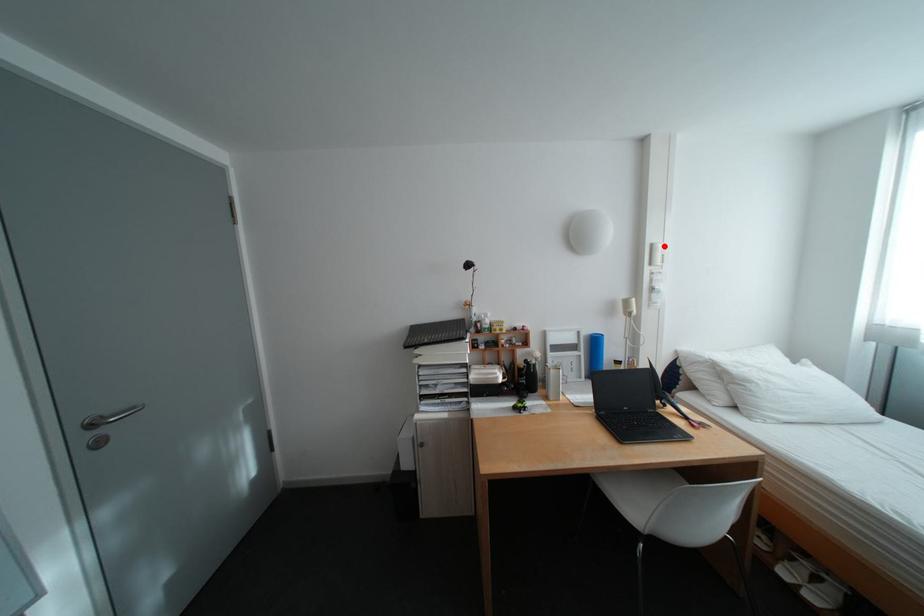
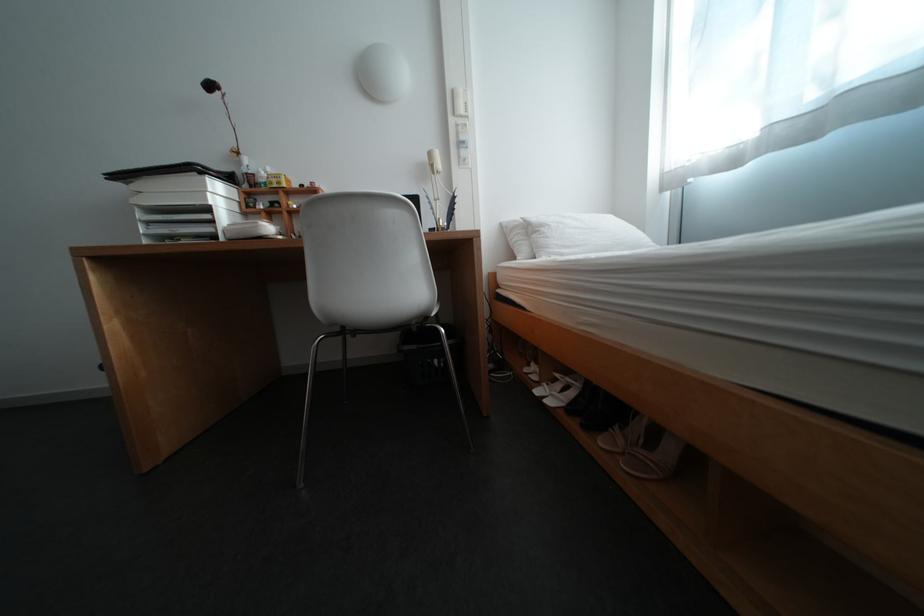
Question: I am providing you with two images of the same scene from different viewpoints. Image1 has a red point marked. In image2, the corresponding 3D location appears at what relative position? Reply with the corresponding letter.

Choices:
 (A) Closer
 (B) Farther

Answer: (A)